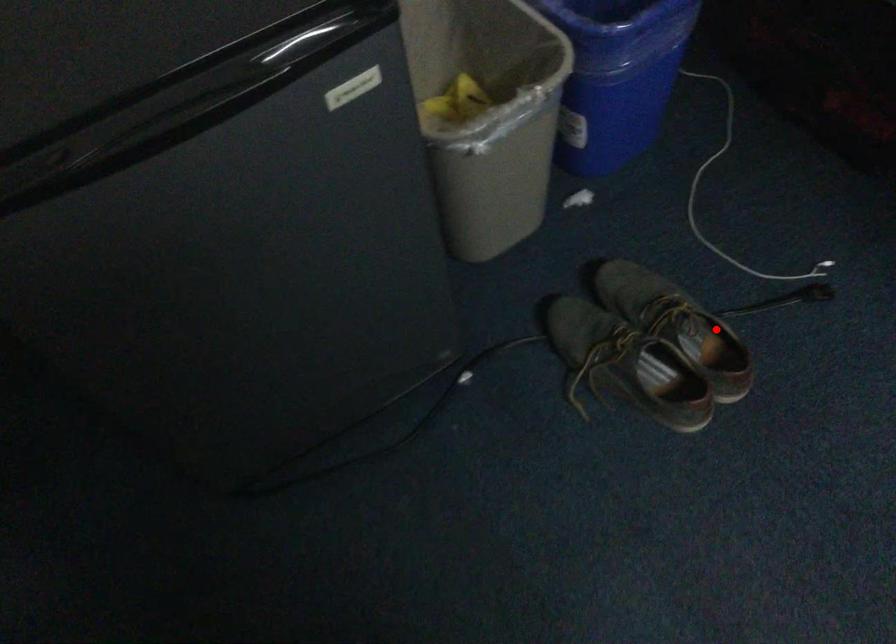
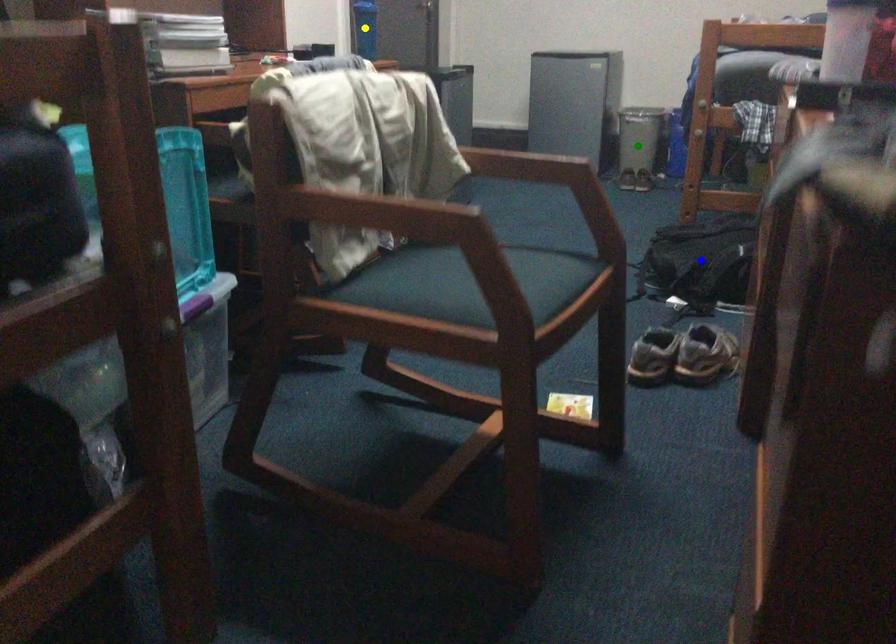
Question: I am providing you with two images of the same scene from different viewpoints. A red point is marked on the first image. You are given multiple points on the second image. Can you choose the point in image 2 that corresponds to the point in image 1?

Choices:
 (A) yellow point
 (B) green point
 (C) blue point

Answer: (B)